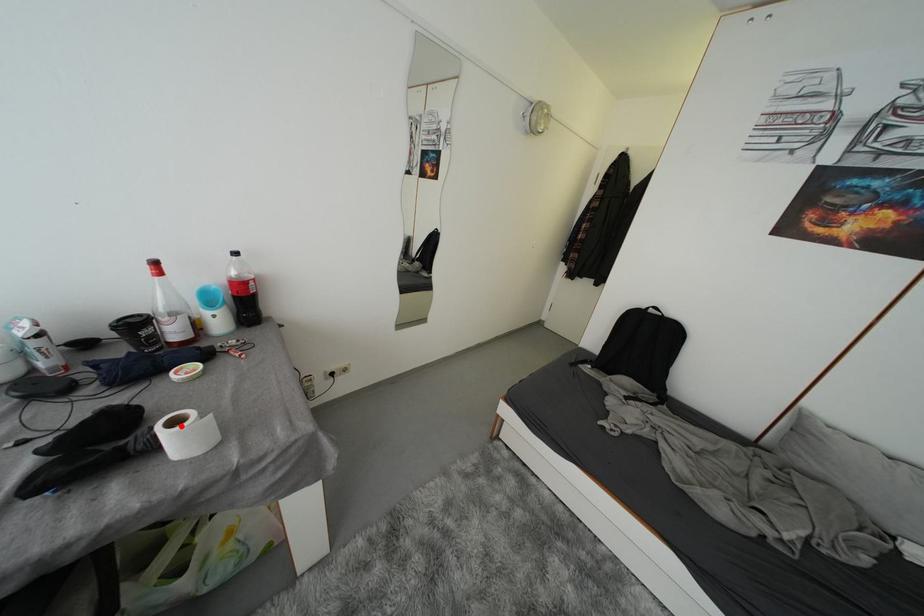
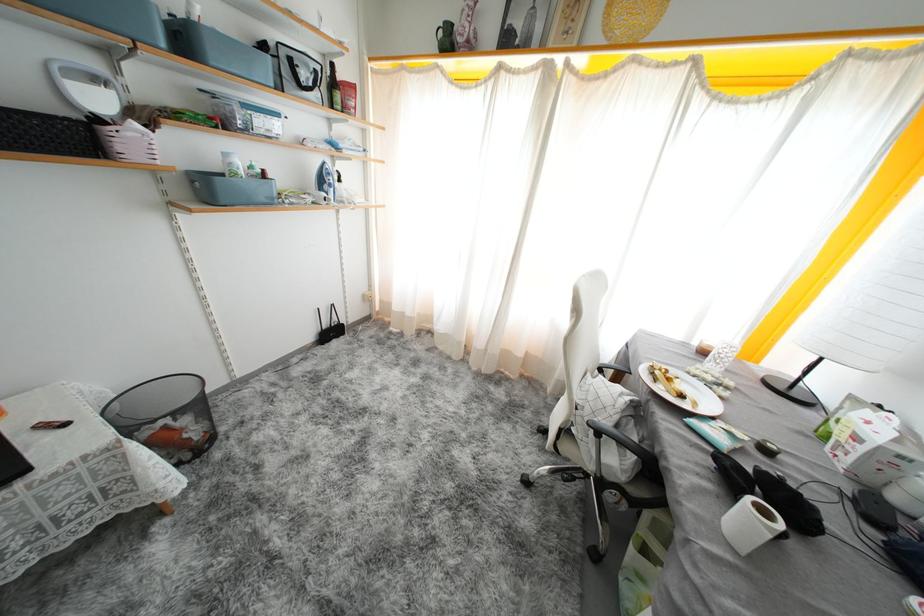
Locate, in the second image, the point that corresponds to the highlighted location in the first image.

(770, 516)